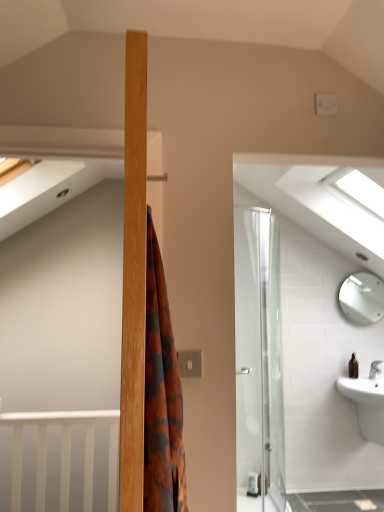
Question: From the image's perspective, relative to white glossy mirror at upper right, is transparent glass window at upper right above or below?

Choices:
 (A) below
 (B) above

Answer: (B)

Question: Looking at their shapes, would you say transparent glass window at upper right is wider or thinner than white glossy mirror at upper right?

Choices:
 (A) wide
 (B) thin

Answer: (A)

Question: Estimate the real-world distances between objects in this image. Which object is closer to the brown glass bottle at lower right?

Choices:
 (A) transparent glass window at upper right
 (B) white glossy sink at lower right
 (C) white glossy mirror at upper right

Answer: (B)

Question: Which object is positioned farthest from the brown glass bottle at lower right?

Choices:
 (A) white glossy sink at lower right
 (B) transparent glass window at upper right
 (C) white glossy mirror at upper right

Answer: (B)